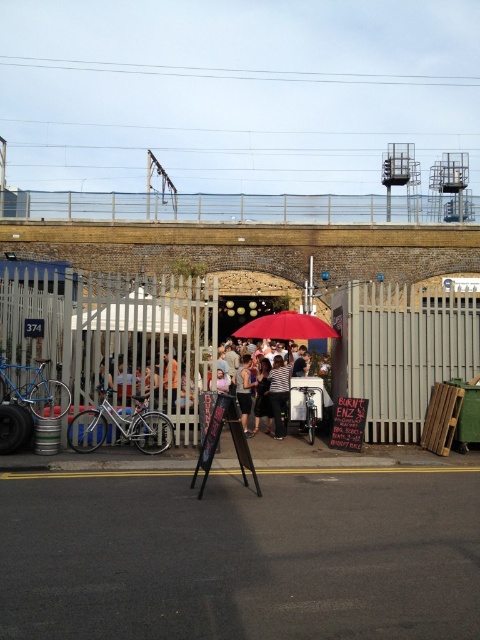
Question: Can you confirm if white wooden fence at center is positioned above matte black easel at center?

Choices:
 (A) yes
 (B) no

Answer: (A)

Question: Estimate the real-world distances between objects in this image. Which object is farther from the matte red umbrella at center?

Choices:
 (A) white wooden fence at center
 (B) matte black easel at center

Answer: (B)

Question: Which of the following is the farthest from the observer?

Choices:
 (A) (73, 390)
 (B) (260, 337)
 (C) (170, 401)
 (D) (243, 378)

Answer: (D)

Question: Considering the relative positions of matte red umbrella at center and striped fabric shirt at center in the image provided, where is matte red umbrella at center located with respect to striped fabric shirt at center?

Choices:
 (A) left
 (B) right

Answer: (B)

Question: Does white wooden fence at center appear under matte black umbrella at center?

Choices:
 (A) no
 (B) yes

Answer: (A)

Question: Estimate the real-world distances between objects in this image. Which object is closer to the brown leather jacket at center?

Choices:
 (A) matte black umbrella at center
 (B) striped fabric shirt at center
 (C) matte black easel at center
 (D) white wooden fence at center

Answer: (D)